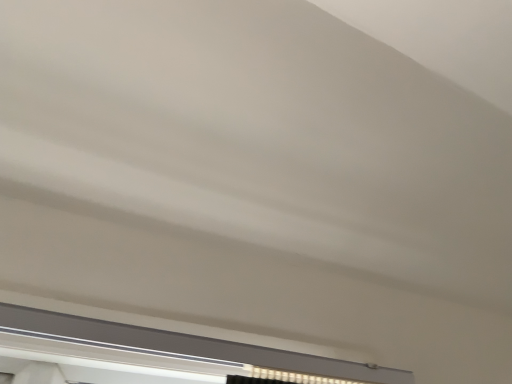
From the picture: In order to face white plastic window at lower center, should I rotate leftwards or rightwards?

To align with it, rotate right about 1.035°.

This screenshot has height=384, width=512. What do you see at coordinates (187, 346) in the screenshot? I see `white plastic window at lower center` at bounding box center [187, 346].

At what (x,y) coordinates should I click in order to perform the action: click on white plastic window at lower center. Please return your answer as a coordinate pair (x, y). Looking at the image, I should click on click(x=187, y=346).

Where is `white plastic window at lower center`? The width and height of the screenshot is (512, 384). white plastic window at lower center is located at coordinates pyautogui.click(x=187, y=346).